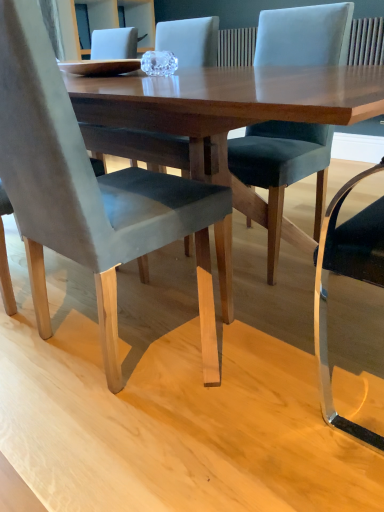
I want to click on vacant space to the right of velvet grey chair at lower left, which is the second chair from right to left, so click(269, 339).